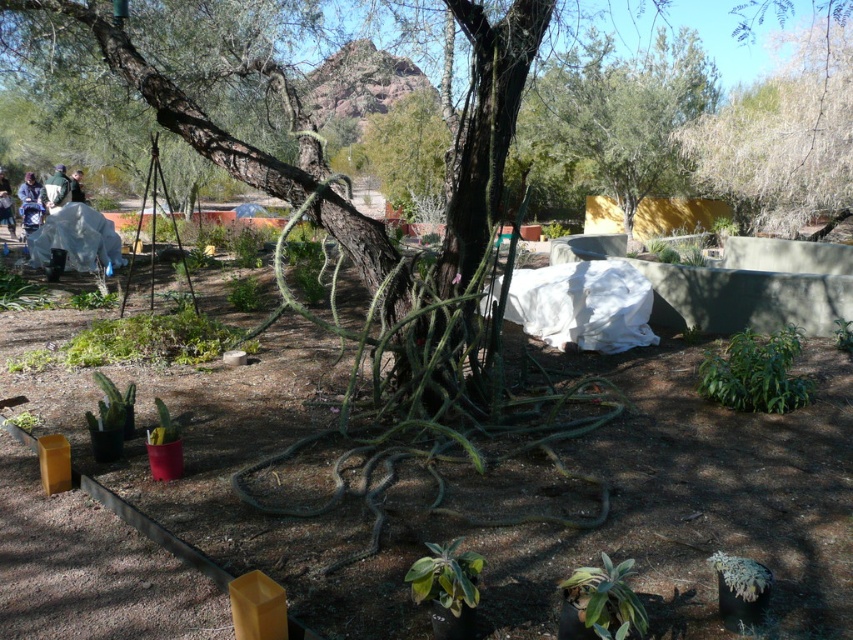
Question: Which point is closer to the camera?

Choices:
 (A) light blue denim jacket at upper left
 (B) white matte suit at left

Answer: (B)

Question: Is white textured tree at upper right to the right of white matte suit at left from the viewer's perspective?

Choices:
 (A) yes
 (B) no

Answer: (A)

Question: Is white matte suit at left to the right of light blue denim jacket at upper left from the viewer's perspective?

Choices:
 (A) yes
 (B) no

Answer: (A)

Question: In this image, where is white textured tree at upper right located relative to light blue denim jacket at upper left?

Choices:
 (A) left
 (B) right

Answer: (B)

Question: Which object is the farthest from the white matte suit at left?

Choices:
 (A) dark blue shirt at upper left
 (B) light blue denim jacket at upper left
 (C) white textured tree at upper right

Answer: (C)

Question: Which of the following is the farthest from the observer?

Choices:
 (A) coord(735,172)
 (B) coord(82,198)
 (C) coord(13,230)

Answer: (A)